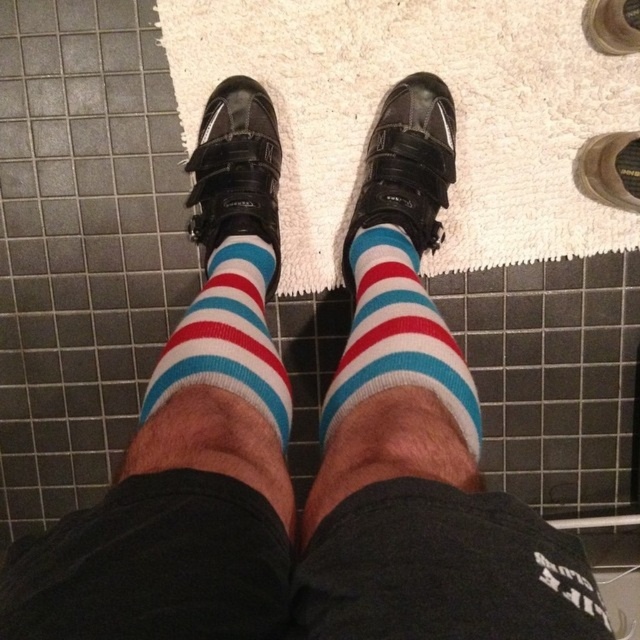
Question: Which point appears closest to the camera in this image?

Choices:
 (A) (51, 634)
 (B) (179, 387)

Answer: (A)

Question: Can you confirm if striped sock at center is positioned to the left of matte black shoe at center?

Choices:
 (A) yes
 (B) no

Answer: (B)

Question: Which point is closer to the camera?

Choices:
 (A) striped sock at center
 (B) black cotton shorts at center

Answer: (B)

Question: Does striped cotton sock at center have a smaller size compared to striped cotton socks at center?

Choices:
 (A) no
 (B) yes

Answer: (B)

Question: Among these objects, which one is nearest to the camera?

Choices:
 (A) striped sock at center
 (B) black cotton shorts at center
 (C) striped cotton socks at center
 (D) matte black shoe at center

Answer: (B)

Question: Does striped cotton socks at center appear over matte black shoe at center?

Choices:
 (A) yes
 (B) no

Answer: (B)